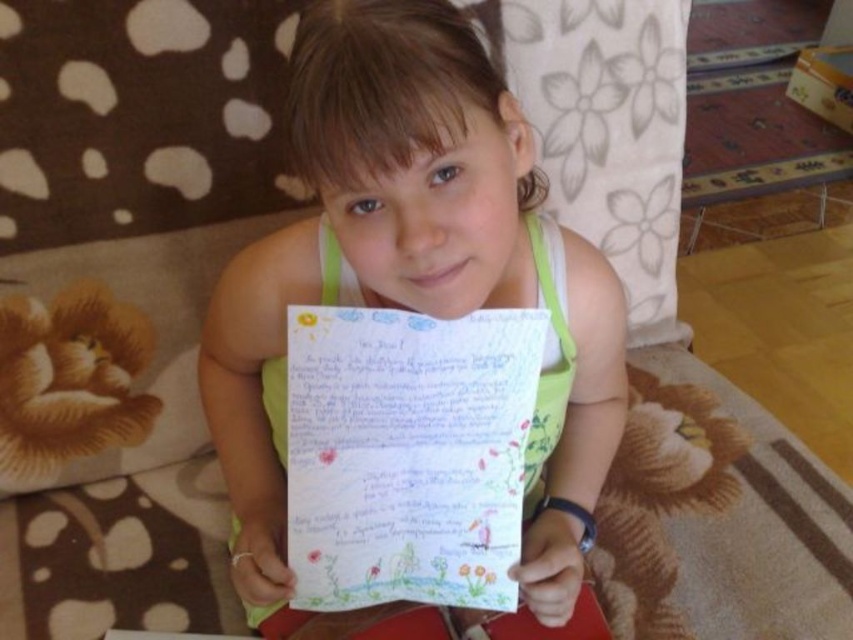
Question: Which of the following is the closest to the observer?

Choices:
 (A) colored paper at center
 (B) green fabric shirt at center

Answer: (B)

Question: Is green fabric shirt at center closer to camera compared to colored paper at center?

Choices:
 (A) yes
 (B) no

Answer: (A)

Question: Which of the following is the closest to the observer?

Choices:
 (A) (490, 428)
 (B) (305, 22)

Answer: (B)

Question: Is green fabric shirt at center smaller than colored paper at center?

Choices:
 (A) yes
 (B) no

Answer: (B)

Question: Can you confirm if green fabric shirt at center is thinner than colored paper at center?

Choices:
 (A) yes
 (B) no

Answer: (B)